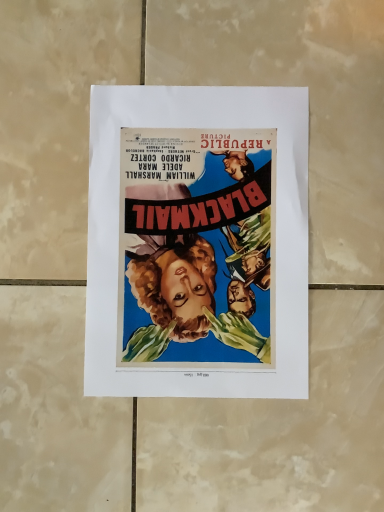
Measure the distance between point (231, 187) and camera.

Point (231, 187) and camera are 40.80 centimeters apart from each other.

Identify the location of vibrant paper poster at center. (197, 242).

What do you see at coordinates (197, 242) in the screenshot? I see `vibrant paper poster at center` at bounding box center [197, 242].

This screenshot has width=384, height=512. In order to click on vibrant paper poster at center in this screenshot , I will do `click(197, 242)`.